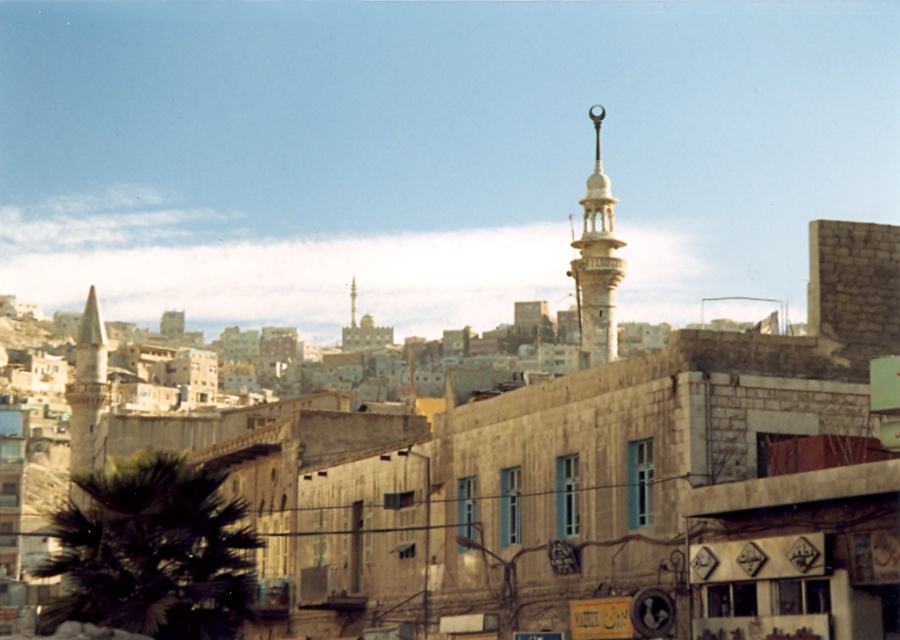
You are standing at the entrance of the commercial building with the Arabic sign. You want to walk towards the smooth stone minaret at center. Is the dark green leafy palm tree at lower left blocking your direct path?

The dark green leafy palm tree at lower left is in front of the smooth stone minaret at center, so it is blocking the direct path to the smooth stone minaret at center.

What is the spatial relationship between the dark green leafy palm tree at lower left and the smooth stone minaret at center?

The dark green leafy palm tree at lower left is positioned to the right of the smooth stone minaret at center.

You are standing in the urban area shown in the image. You notice a dark green leafy palm tree at lower left and a stone tower at left. Which of these two objects is taller?

The stone tower at left is taller than the dark green leafy palm tree at lower left.